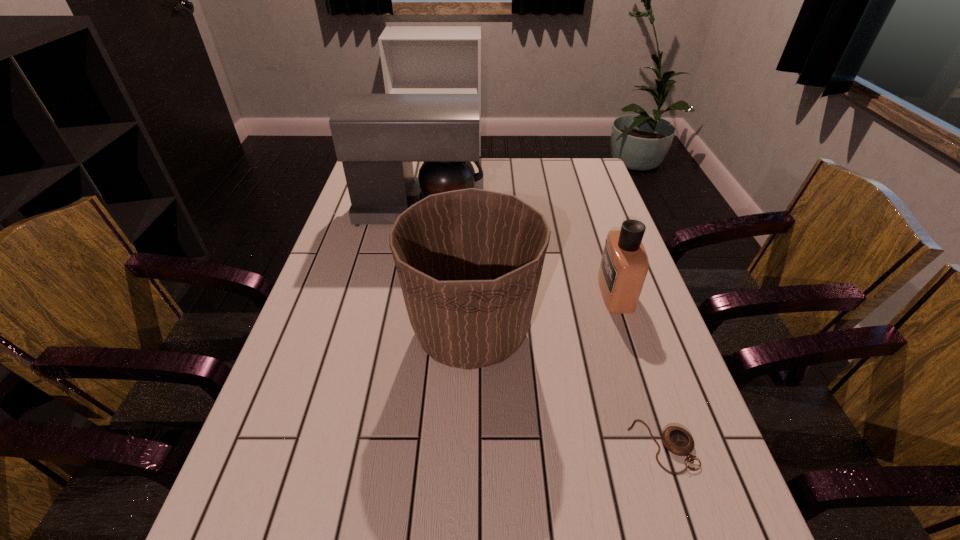
At what (x,y) coordinates should I click in order to perform the action: click on free point located 0.190m on the back of the nearest object. Please return your answer as a coordinate pair (x, y). Looking at the image, I should click on (630, 346).

This screenshot has width=960, height=540. I want to click on object that is at the left edge, so click(377, 137).

This screenshot has width=960, height=540. Identify the location of perfume present at the right edge. (624, 265).

At what (x,y) coordinates should I click in order to perform the action: click on pocket watch located in the right edge section of the desktop. Please return your answer as a coordinate pair (x, y). Image resolution: width=960 pixels, height=540 pixels. Looking at the image, I should click on (677, 440).

I want to click on vacant region at the far edge of the desktop, so [489, 178].

The image size is (960, 540). Identify the location of vacant space at the left edge of the desktop. (297, 461).

Where is `free location at the right edge`? The width and height of the screenshot is (960, 540). free location at the right edge is located at coordinates (694, 473).

In the image, there is a desktop. Identify the location of free space at the far right corner. This screenshot has width=960, height=540. (x=568, y=162).

You are a GUI agent. You are given a task and a screenshot of the screen. Output one action in this format:
    pyautogui.click(x=<x>, y=<y>)
    Task: Click on the vacant area that lies between the flowerpot and the pocket watch
    This screenshot has width=960, height=540.
    Given the screenshot: What is the action you would take?
    pyautogui.click(x=566, y=389)

Identify the location of free space between the perfume and the flowerpot. (543, 312).